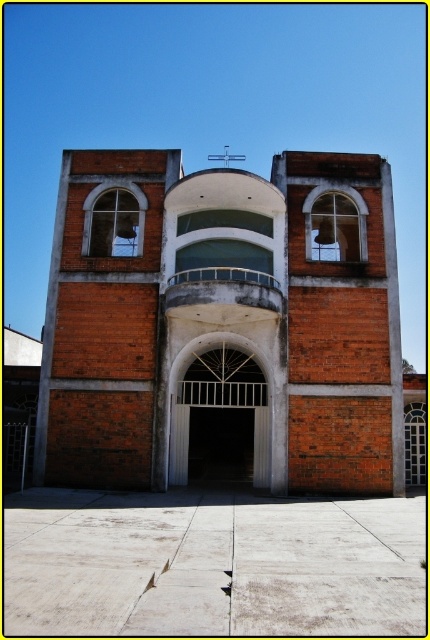
Question: Where is brick building at center located in relation to white metal gate at center in the image?

Choices:
 (A) above
 (B) below

Answer: (A)

Question: Which point is farther to the camera?

Choices:
 (A) white metal gate at center
 (B) brick building at center

Answer: (A)

Question: Which of the following is the farthest from the observer?

Choices:
 (A) (177, 342)
 (B) (202, 442)

Answer: (B)

Question: Where is brick building at center located in relation to white metal gate at center in the image?

Choices:
 (A) left
 (B) right

Answer: (A)

Question: Which point appears closest to the camera in this image?

Choices:
 (A) (205, 403)
 (B) (197, 308)

Answer: (B)

Question: Is brick building at center smaller than white metal gate at center?

Choices:
 (A) no
 (B) yes

Answer: (A)